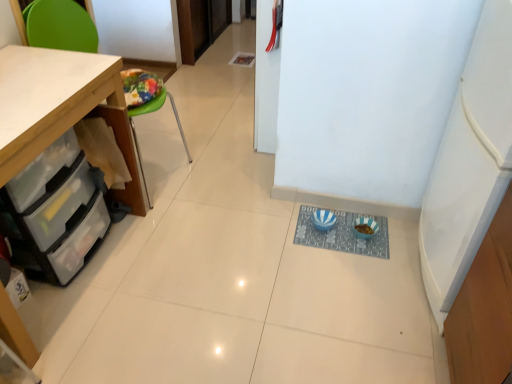
You are a GUI agent. You are given a task and a screenshot of the screen. Output one action in this format:
    pyautogui.click(x=<x>, y=<y>)
    Task: Click on the free space to the left of blue striped bowls at center
    
    Given the screenshot: What is the action you would take?
    pyautogui.click(x=269, y=235)